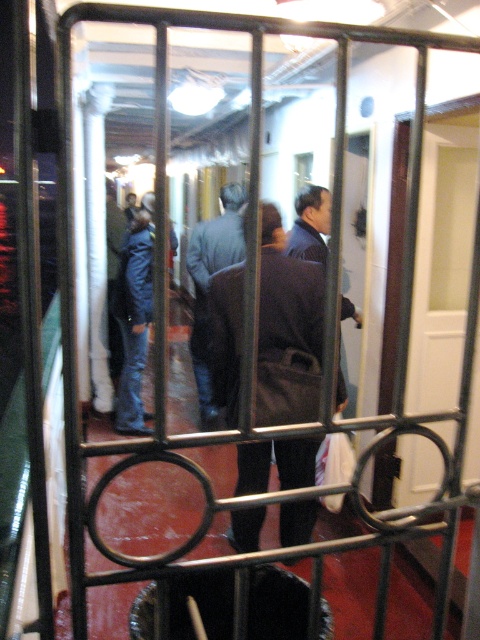
Question: Can you confirm if white matte door at right is thinner than dark brown leather coat at center?

Choices:
 (A) no
 (B) yes

Answer: (B)

Question: Which object is farther from the camera taking this photo?

Choices:
 (A) dark gray suit at center
 (B) white matte door at right

Answer: (A)

Question: Among these objects, which one is farthest from the camera?

Choices:
 (A) dark gray suit at center
 (B) dark brown leather coat at center

Answer: (A)

Question: Can you confirm if dark brown leather coat at center is bigger than dark gray suit at center?

Choices:
 (A) no
 (B) yes

Answer: (B)

Question: Is dark brown leather coat at center positioned behind dark gray suit at center?

Choices:
 (A) yes
 (B) no

Answer: (B)

Question: Estimate the real-world distances between objects in this image. Which object is farther from the dark gray suit at center?

Choices:
 (A) dark brown leather coat at center
 (B) white matte door at right

Answer: (A)